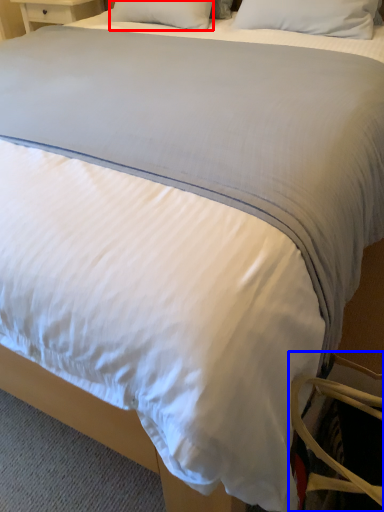
Question: Which object appears closest to the camera in this image, pillow (highlighted by a red box) or swivel chair (highlighted by a blue box)?

Choices:
 (A) pillow
 (B) swivel chair

Answer: (B)